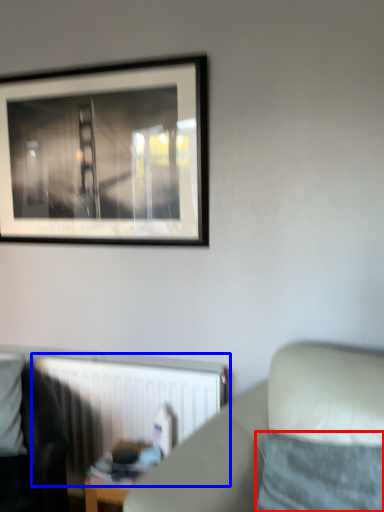
Question: Which object appears farthest to the camera in this image, pillow (highlighted by a red box) or radiator (highlighted by a blue box)?

Choices:
 (A) pillow
 (B) radiator

Answer: (B)